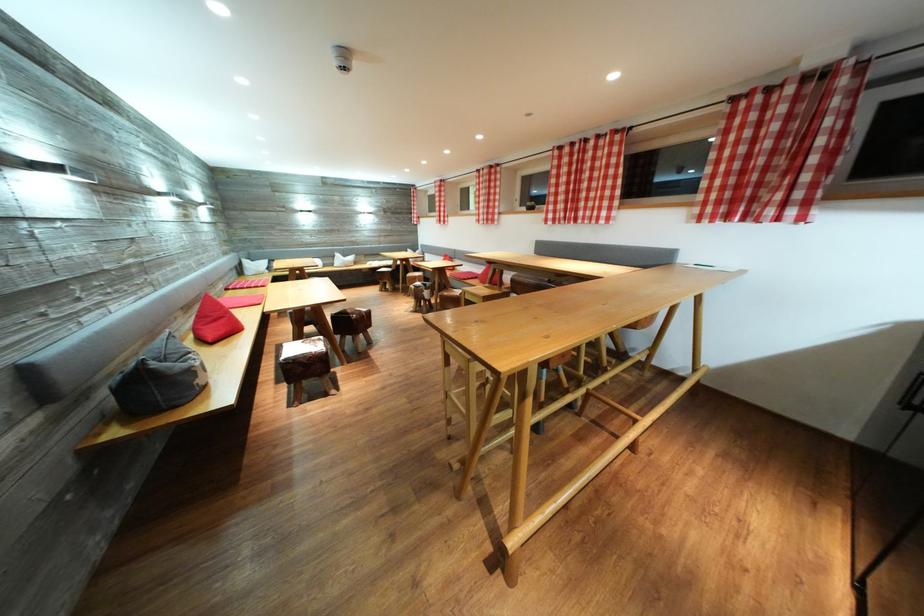
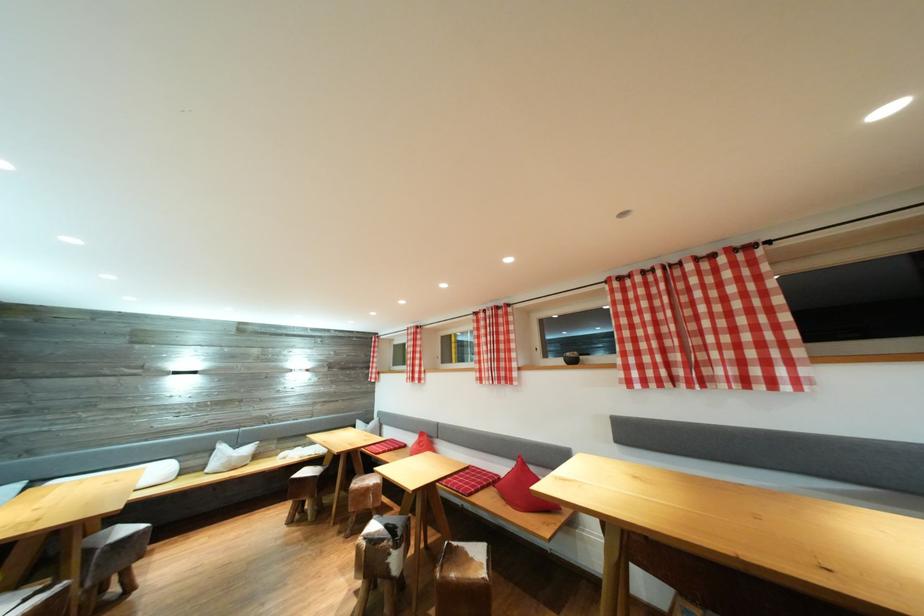
The point at (494, 219) is marked in the first image. Where is the corresponding point in the second image?

(505, 374)